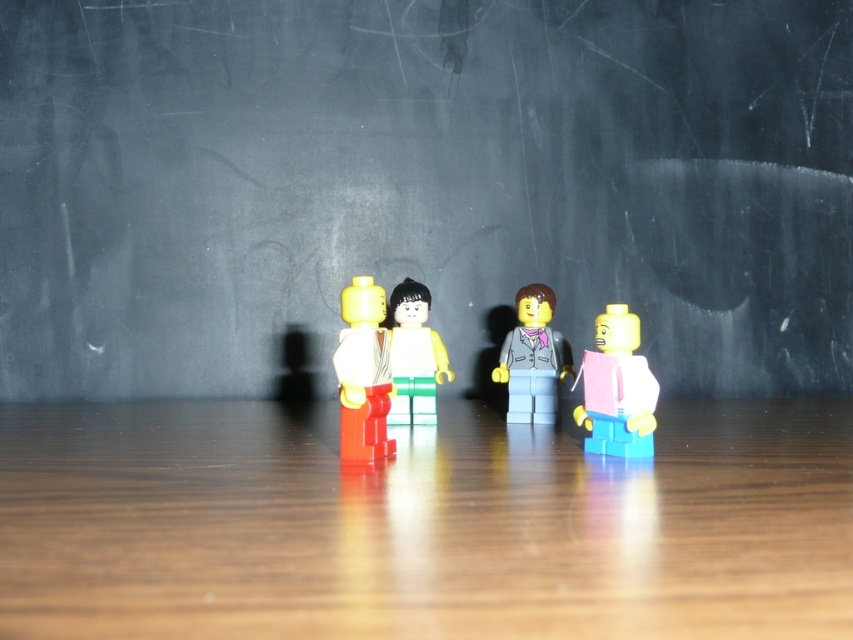
You are a photographer setting up a shot of the LEGO minifigures. You need to adjust the focus so that the matte plastic minifigure at center and the matte yellow minifigure at center are both in sharp focus. Which figure should you focus on first to ensure both are in focus?

You should focus on the matte plastic minifigure at center first because it is closer to the viewer than the matte yellow minifigure at center. By focusing on the closer object, the depth of field may extend to include the farther one in acceptable focus.

You are organizing a display of LEGO minifigures on a desk. You have two figures to place in the center area. The first is a matte plastic minifigure at center, and the second is a matte yellow minifigure at center. According to the scene, which figure should you place lower on the desk?

The matte plastic minifigure at center should be placed lower on the desk since it is located below the matte yellow minifigure at center according to the scene description.